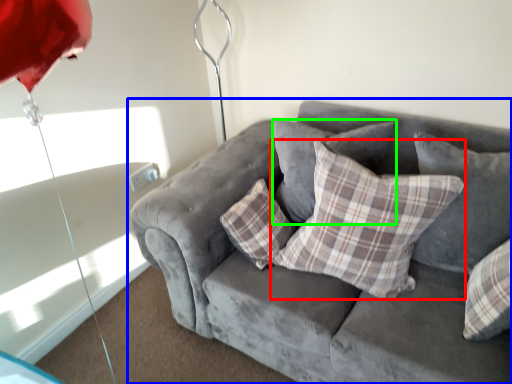
Question: Which object is positioned closest to pillow (highlighted by a red box)? Select from studio couch (highlighted by a blue box) and pillow (highlighted by a green box).

Choices:
 (A) studio couch
 (B) pillow

Answer: (A)